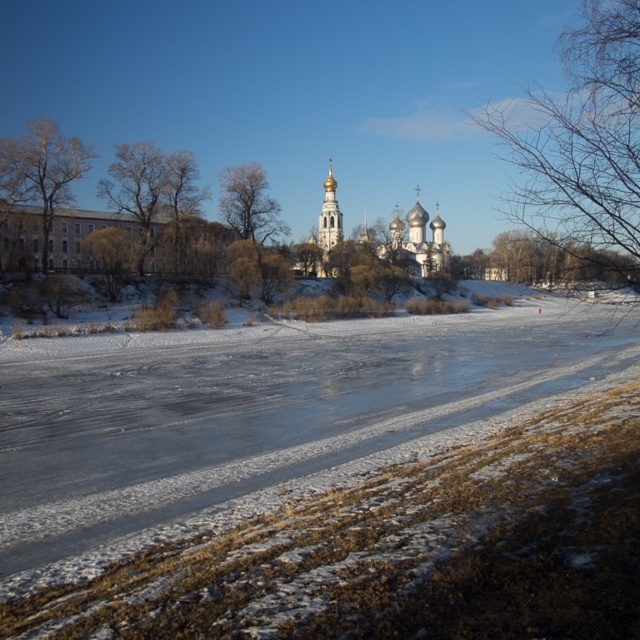
You are an ornithologist observing a winter landscape. You notice two trees in the scene. One is the bare branches at upper right and the other is the brown leafless tree at left. Which of these two trees is positioned more to the east if the sun is setting in the west?

The bare branches at upper right is positioned more to the east because it is to the right of the brown leafless tree at left, and since the sun is setting in the west, the right side of the image corresponds to the east direction.

You are an artist planning to paint the winter scene. You want to place the bare wood tree at center and the brown textured tree at left in your painting. According to the scene, which tree should be drawn on the left side of the other?

The brown textured tree at left should be drawn on the left side since the bare wood tree at center is positioned on the right side of it.